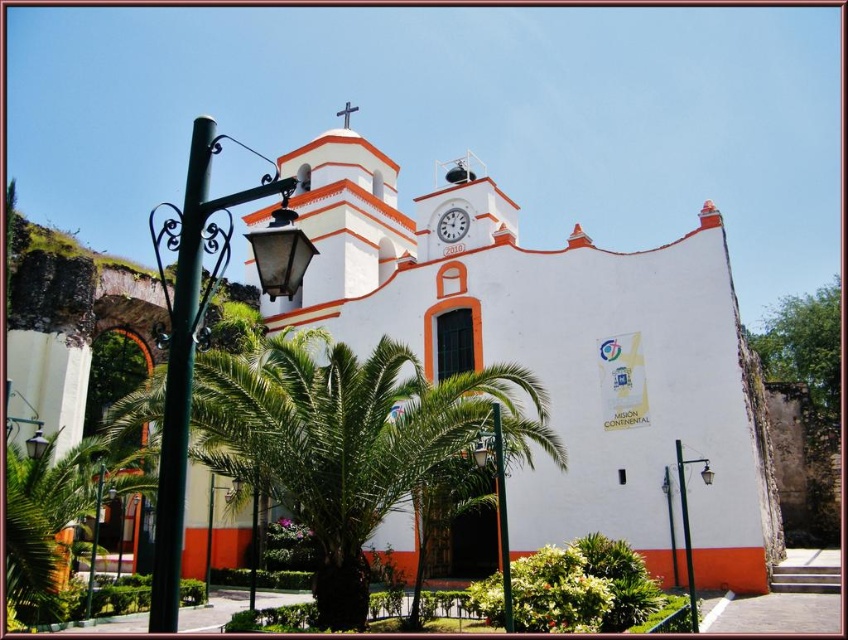
You are standing at the entrance of the church and want to determine which object is taller between the black metal streetlight at lower right and the orange matte spire at upper center. Based on their positions and the scene description, which one is taller?

The black metal streetlight at lower right is taller than the orange matte spire at upper center according to the description.

You are standing in front of the church and want to take a photo of the orange matte spire at upper center without any obstructions. Is the green wrought iron streetlight at left blocking your view of it?

The green wrought iron streetlight at left is in front of the orange matte spire at upper center, so it would block your view of the spire.

You are standing in front of the church and want to take a photo of the orange matte spire at upper center without any obstructions. Is the black metal streetlight at lower right blocking your view of the spire?

The black metal streetlight at lower right is positioned under the orange matte spire at upper center, so it is directly below the spire and may block the view depending on the angle. To capture an unobstructed photo of the orange matte spire at upper center, you should position yourself so that the streetlight is not in the line of sight between you and the spire.